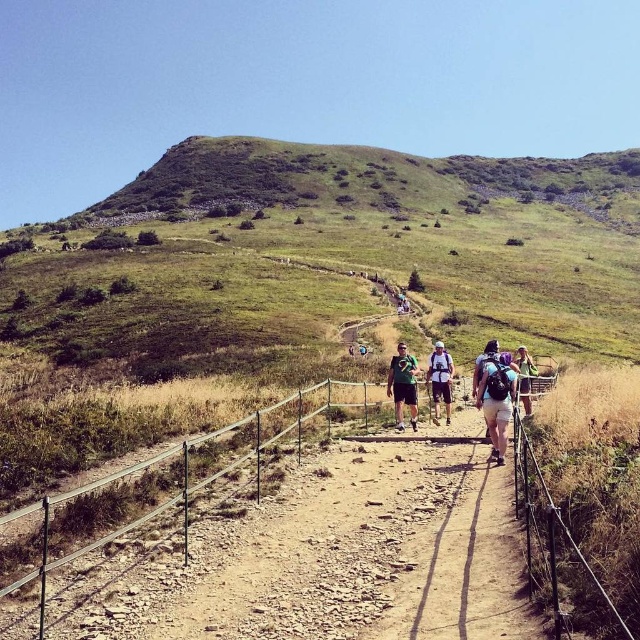
Consider the image. You are a hiker on the trail and want to reach the point marked as point (397,387). You are currently at point (520,348). Which direction should you move to get closer to your destination?

To reach point (397,387) from point (520,348), you should move downward because the destination is in front of your current position.